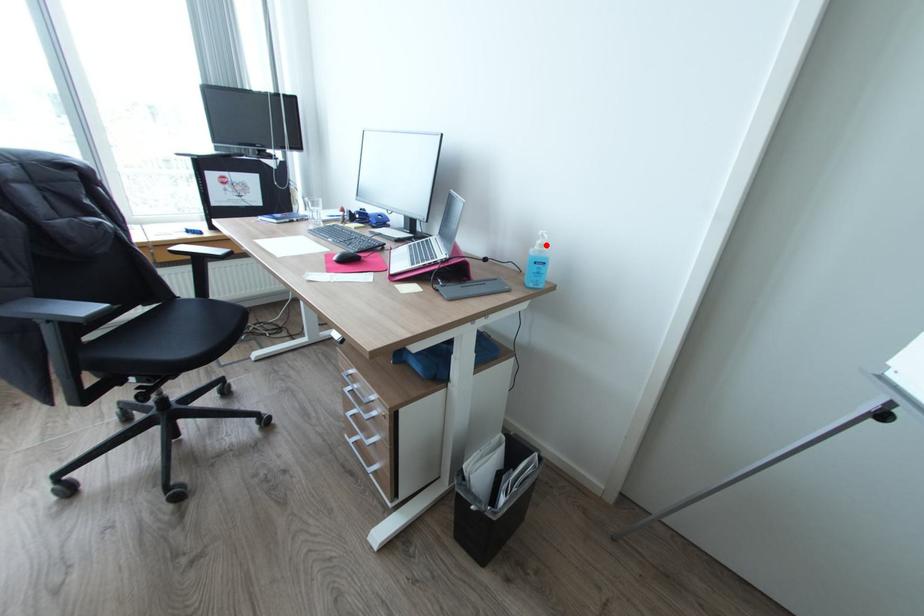
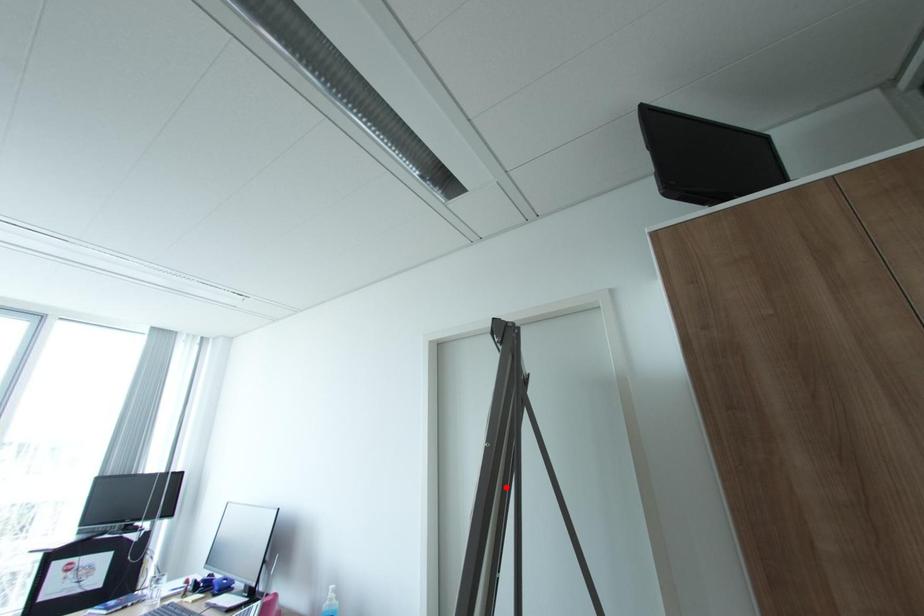
I am providing you with two images of the same scene from different viewpoints. A red point is marked on the first image and another point is marked on the second image. Are the points marked in image1 and image2 representing the same 3D position?

No